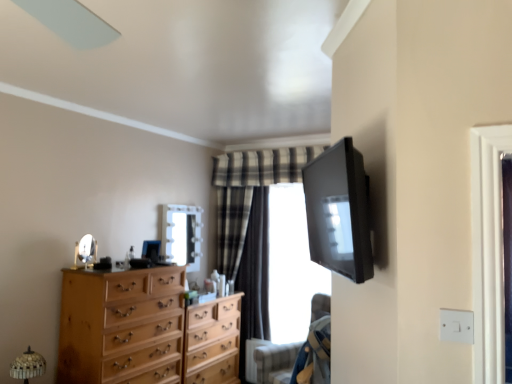
Question: Considering the relative positions of plaid fabric curtain at center and light wood chest of drawers at center, the second chest of drawers in the front-to-back sequence, in the image provided, is plaid fabric curtain at center to the right of light wood chest of drawers at center, the second chest of drawers in the front-to-back sequence, from the viewer's perspective?

Choices:
 (A) no
 (B) yes

Answer: (B)

Question: Is plaid fabric curtain at center far from light wood chest of drawers at center, positioned as the first chest of drawers in back-to-front order?

Choices:
 (A) yes
 (B) no

Answer: (B)

Question: Is plaid fabric curtain at center further to the viewer compared to light wood chest of drawers at center, the second chest of drawers in the front-to-back sequence?

Choices:
 (A) yes
 (B) no

Answer: (A)

Question: Is plaid fabric curtain at center aimed at light wood chest of drawers at center, the second chest of drawers in the front-to-back sequence?

Choices:
 (A) no
 (B) yes

Answer: (B)

Question: Would you say plaid fabric curtain at center is outside light wood chest of drawers at center, the second chest of drawers in the front-to-back sequence?

Choices:
 (A) no
 (B) yes

Answer: (B)

Question: Relative to denim fabric armchair at lower right, is wooden dresser at left, the second chest of drawers viewed from the back, in front or behind?

Choices:
 (A) front
 (B) behind

Answer: (B)

Question: From a real-world perspective, is wooden dresser at left, which is the 1th chest of drawers in front-to-back order, physically located above or below denim fabric armchair at lower right?

Choices:
 (A) above
 (B) below

Answer: (B)

Question: Would you say wooden dresser at left, which is the 1th chest of drawers in front-to-back order, is inside or outside denim fabric armchair at lower right?

Choices:
 (A) outside
 (B) inside

Answer: (A)

Question: In terms of height, does wooden dresser at left, the second chest of drawers viewed from the back, look taller or shorter compared to denim fabric armchair at lower right?

Choices:
 (A) tall
 (B) short

Answer: (A)

Question: From a real-world perspective, relative to matte black tv at upper right, is clear glass window at center vertically above or below?

Choices:
 (A) above
 (B) below

Answer: (B)

Question: From the image's perspective, is clear glass window at center located above or below matte black tv at upper right?

Choices:
 (A) below
 (B) above

Answer: (A)

Question: In terms of height, does clear glass window at center look taller or shorter compared to matte black tv at upper right?

Choices:
 (A) tall
 (B) short

Answer: (A)

Question: Based on their sizes in the image, would you say clear glass window at center is bigger or smaller than matte black tv at upper right?

Choices:
 (A) small
 (B) big

Answer: (B)

Question: Considering the positions of point (259, 377) and point (88, 248), is point (259, 377) closer or farther from the camera than point (88, 248)?

Choices:
 (A) closer
 (B) farther

Answer: (B)

Question: In terms of width, does denim fabric armchair at lower right look wider or thinner when compared to silver/metallic mirror at center-left, positioned as the 1th mirror in front-to-back order?

Choices:
 (A) thin
 (B) wide

Answer: (B)